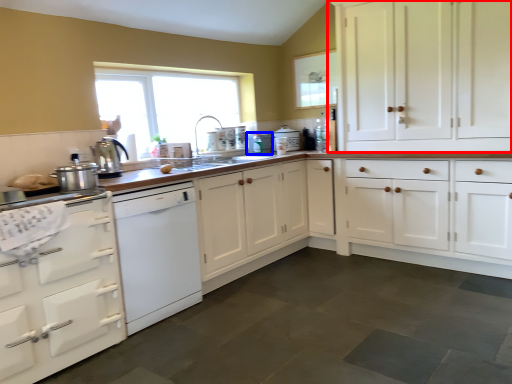
Question: Which of the following is the closest to the observer, cabinetry (highlighted by a red box) or appliance (highlighted by a blue box)?

Choices:
 (A) cabinetry
 (B) appliance

Answer: (A)